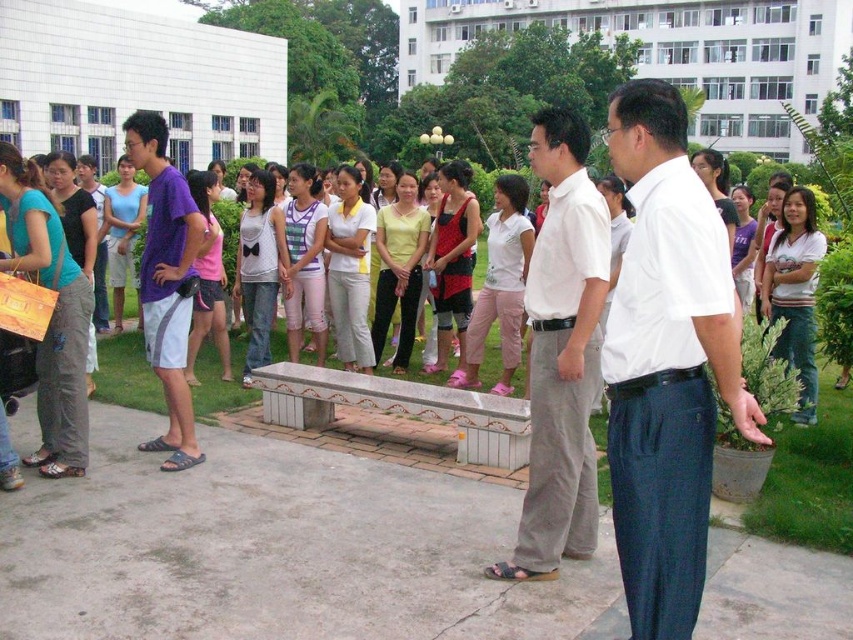
Consider the image. Is white smooth shirt at center to the right of purple fabric shorts at left from the viewer's perspective?

Yes, white smooth shirt at center is to the right of purple fabric shorts at left.

Which is more to the left, white smooth shirt at center or purple fabric shorts at left?

From the viewer's perspective, purple fabric shorts at left appears more on the left side.

Who is more forward, [695,208] or [160,204]?

Positioned in front is point [695,208].

Identify the location of white smooth shirt at center. The width and height of the screenshot is (853, 640). (666, 364).

Who is positioned more to the left, white smooth shirt at center or white striped shirt at center?

Positioned to the left is white smooth shirt at center.

The height and width of the screenshot is (640, 853). I want to click on white smooth shirt at center, so click(x=666, y=364).

Find the location of a particular element. This screenshot has height=640, width=853. white smooth shirt at center is located at coordinates (666, 364).

Between point (561, 337) and point (167, 244), which one is positioned behind?

Point (167, 244)

Is white cotton shirt at center in front of purple fabric shorts at left?

Yes, white cotton shirt at center is in front of purple fabric shorts at left.

This screenshot has width=853, height=640. In order to click on white cotton shirt at center in this screenshot , I will do `click(561, 353)`.